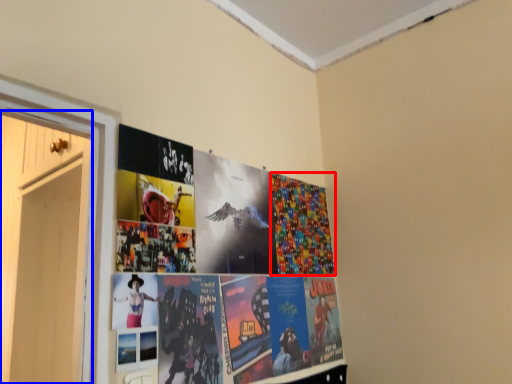
Question: Among these objects, which one is nearest to the camera, flyer (highlighted by a red box) or door (highlighted by a blue box)?

Choices:
 (A) flyer
 (B) door

Answer: (B)